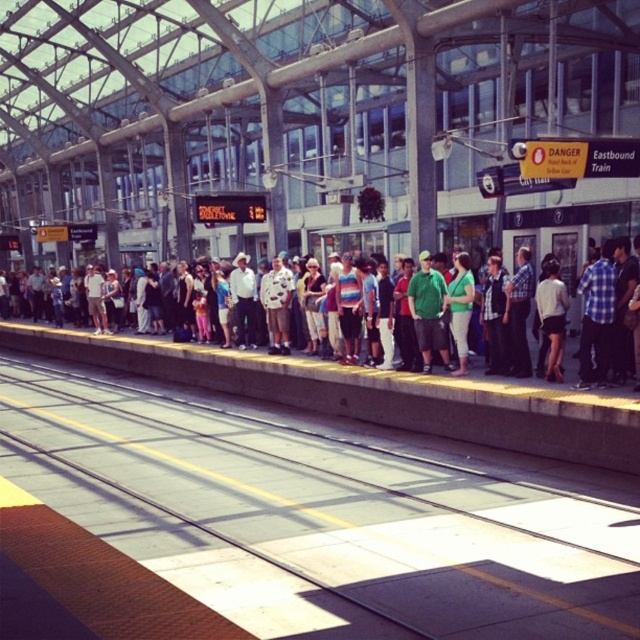
Is the position of smooth concrete train track at center more distant than that of multicolored casual clothing at center?

No, it is in front of multicolored casual clothing at center.

Does smooth concrete train track at center appear over multicolored casual clothing at center?

Actually, smooth concrete train track at center is below multicolored casual clothing at center.

Does point (88, 509) come behind point (428, 365)?

No, (88, 509) is closer to viewer.

This screenshot has width=640, height=640. I want to click on smooth concrete train track at center, so click(321, 516).